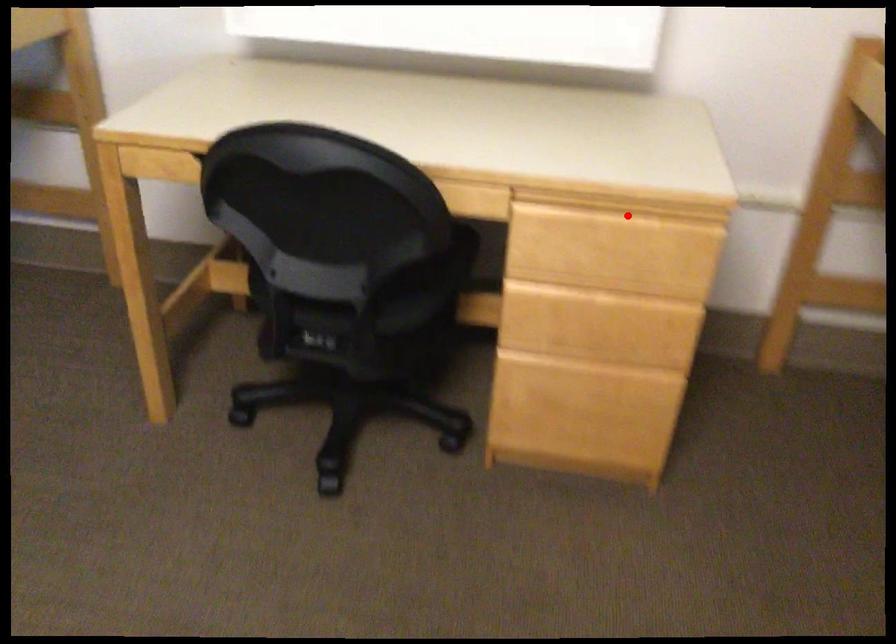
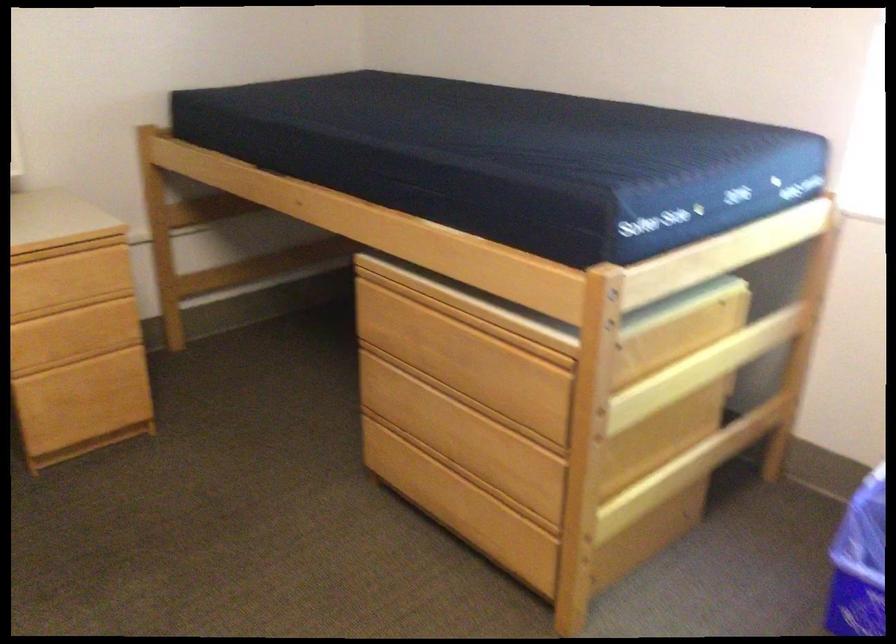
Locate, in the second image, the point that corresponds to the highlighted location in the first image.

(65, 250)